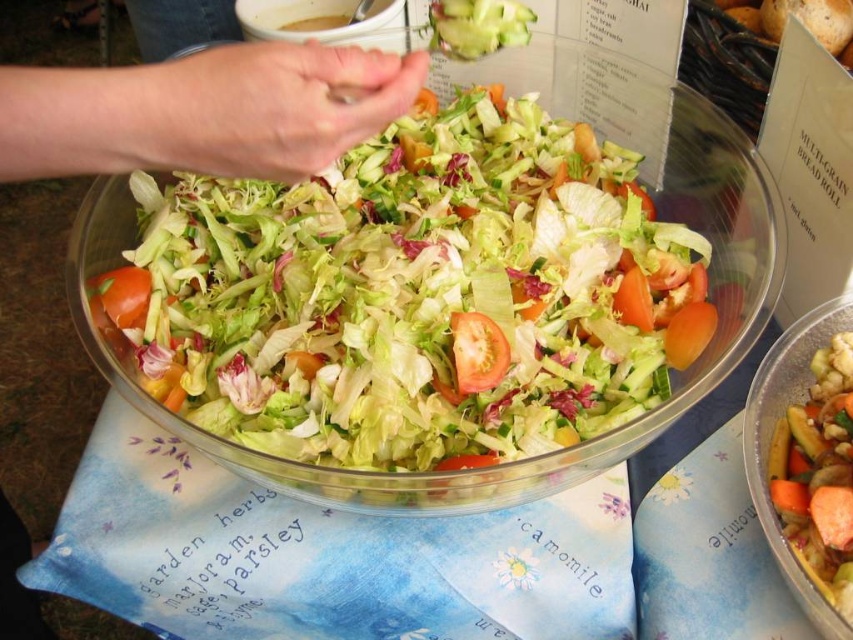
Question: Which point is farther to the camera?

Choices:
 (A) (492, 371)
 (B) (132, 140)

Answer: (A)

Question: Which object appears farthest from the camera in this image?

Choices:
 (A) skinny white hand at upper left
 (B) red matte tomato at lower left
 (C) fresh green salad at center
 (D) juicy red tomato at center

Answer: (B)

Question: Is fresh green salad at center further to the viewer compared to skinny white hand at upper left?

Choices:
 (A) no
 (B) yes

Answer: (B)

Question: Is translucent plastic salad bowl at center smaller than red matte tomato at lower left?

Choices:
 (A) yes
 (B) no

Answer: (B)

Question: Among these objects, which one is nearest to the camera?

Choices:
 (A) translucent plastic salad bowl at center
 (B) skinny white hand at upper left

Answer: (B)

Question: In this image, where is skinny white hand at upper left located relative to translucent plastic salad bowl at center?

Choices:
 (A) above
 (B) below

Answer: (A)